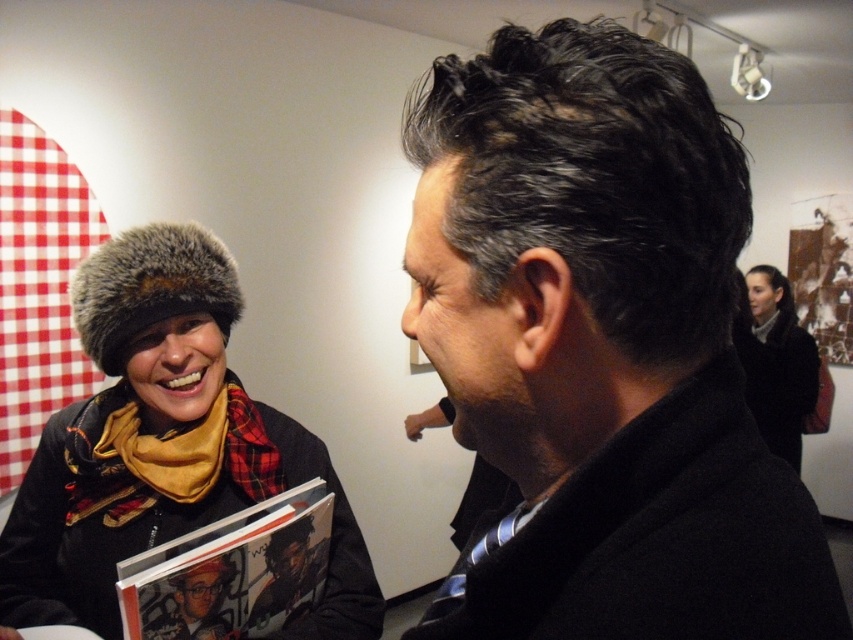
Question: Does white glossy book at lower left have a larger size compared to matte black book at center?

Choices:
 (A) no
 (B) yes

Answer: (B)

Question: Does velvet black jacket at lower left have a smaller size compared to matte black book at center?

Choices:
 (A) yes
 (B) no

Answer: (B)

Question: Can you confirm if white glossy book at lower left is positioned to the right of matte black jacket at center?

Choices:
 (A) no
 (B) yes

Answer: (B)

Question: Which object is positioned closest to the black wool coat at right?

Choices:
 (A) matte black jacket at center
 (B) velvet black jacket at lower left
 (C) white glossy book at lower left
 (D) black wool coat at upper right

Answer: (B)

Question: Among these objects, which one is nearest to the camera?

Choices:
 (A) matte black jacket at center
 (B) matte black book at center
 (C) white glossy book at lower left
 (D) velvet black jacket at lower left

Answer: (C)

Question: Which object is the farthest from the white glossy book at lower left?

Choices:
 (A) velvet black jacket at lower left
 (B) black wool coat at right

Answer: (B)